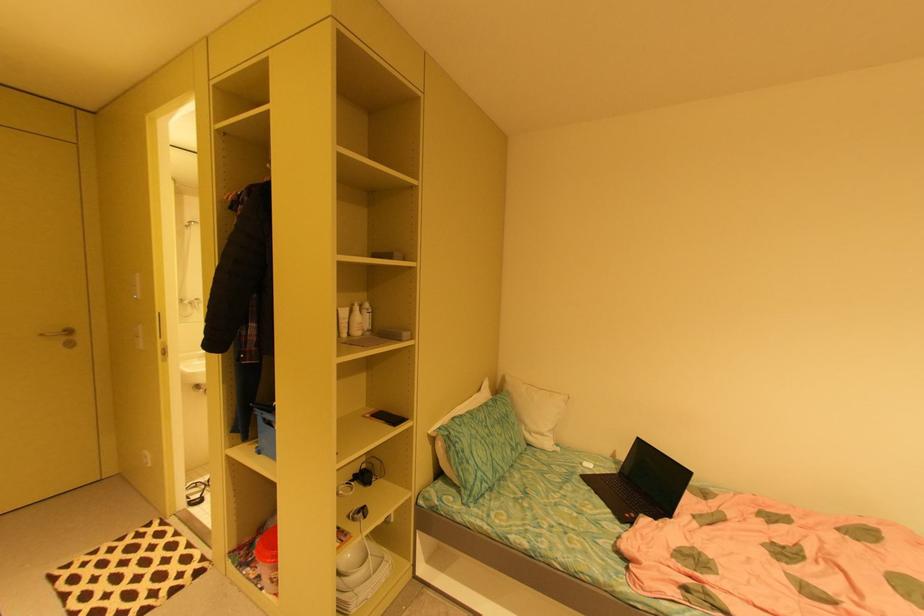
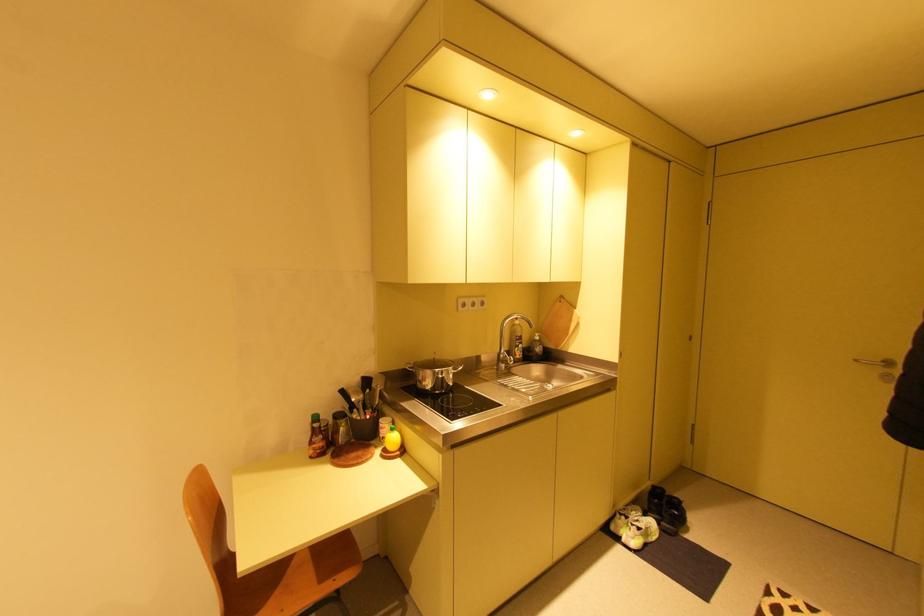
Question: How did the camera likely rotate?

Choices:
 (A) Left
 (B) Right
 (C) Up
 (D) Down

Answer: (A)